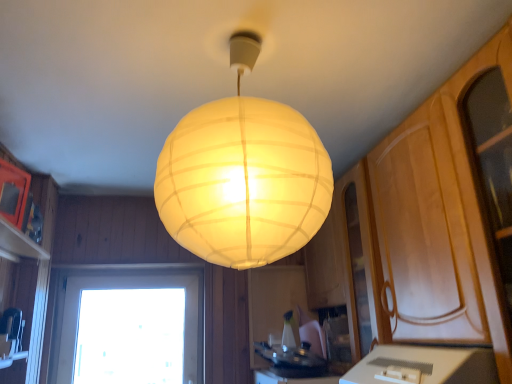
You are a GUI agent. You are given a task and a screenshot of the screen. Output one action in this format:
    pyautogui.click(x=<x>, y=<y>)
    Task: Click on the free point above white paper lampshade at center (from a real-world perspective)
    This screenshot has height=384, width=512.
    Given the screenshot: What is the action you would take?
    pyautogui.click(x=243, y=32)